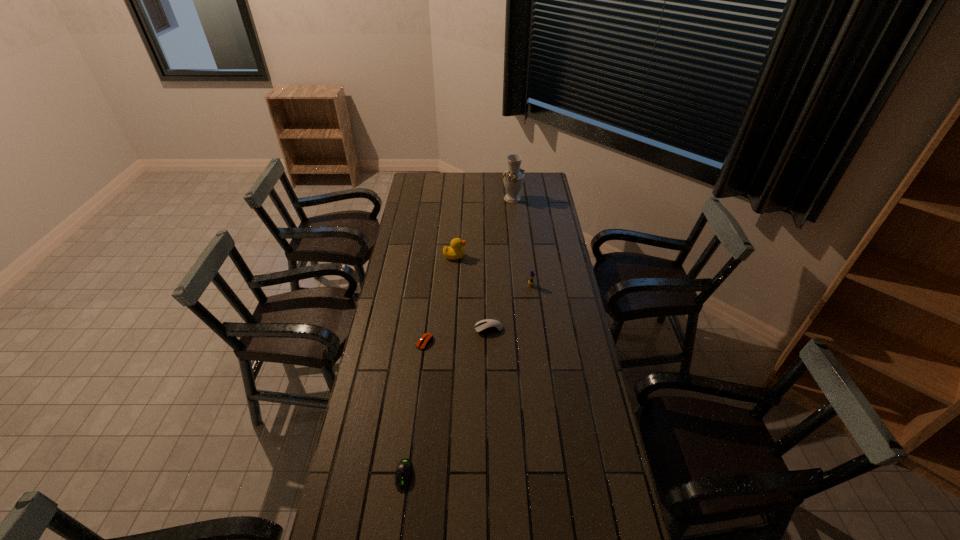
At what (x,y) coordinates should I click in order to perform the action: click on free point at the right edge. Please return your answer as a coordinate pair (x, y). Looking at the image, I should click on (571, 488).

This screenshot has height=540, width=960. Find the location of `free space at the far left corner of the desktop`. free space at the far left corner of the desktop is located at coordinates (415, 181).

The image size is (960, 540). I want to click on free space between the fourth object from right to left and the shortest computer mouse, so click(x=440, y=299).

What are the coordinates of `empty location between the farthest object and the rightmost computer mouse` in the screenshot? It's located at (500, 264).

Where is `free area in between the shortest object and the fourth nearest object`? The image size is (960, 540). free area in between the shortest object and the fourth nearest object is located at coordinates (477, 314).

At what (x,y) coordinates should I click in order to perform the action: click on vacant region between the duck and the shortest object. Please return your answer as a coordinate pair (x, y). The height and width of the screenshot is (540, 960). Looking at the image, I should click on (440, 299).

Identify the location of vacant point located between the second tallest object and the fourth tallest object. (471, 293).

Where is `free spot between the shortest computer mouse and the rightmost computer mouse`? free spot between the shortest computer mouse and the rightmost computer mouse is located at coordinates (457, 335).

In order to click on vacant space that is in between the tallest object and the nearest computer mouse in this screenshot , I will do `click(458, 337)`.

Identify the location of free space between the tallest object and the duckling. (521, 242).